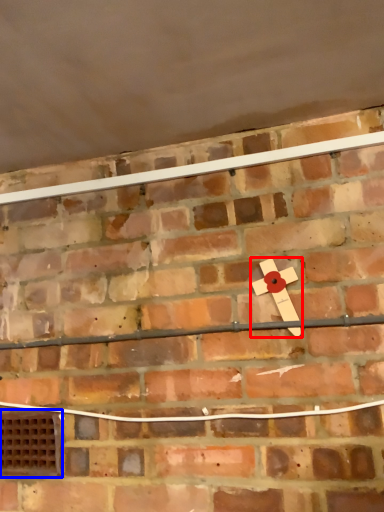
Question: Which object appears farthest to the camera in this image, magnet (highlighted by a red box) or window (highlighted by a blue box)?

Choices:
 (A) magnet
 (B) window

Answer: (B)